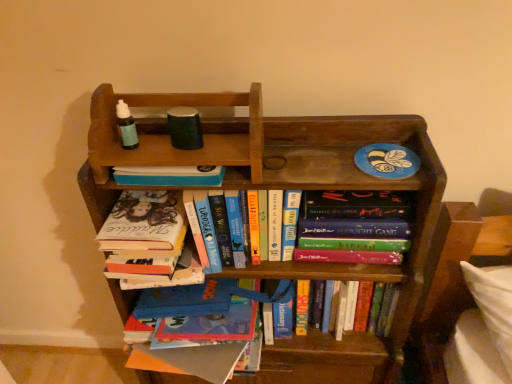
The image size is (512, 384). What do you see at coordinates (384, 306) in the screenshot? I see `hardcover book at center, arranged as the first book when ordered from the bottom` at bounding box center [384, 306].

This screenshot has height=384, width=512. Find the location of `wooden bookcase at center`. wooden bookcase at center is located at coordinates (283, 188).

You are a GUI agent. You are given a task and a screenshot of the screen. Output one action in this format:
    pyautogui.click(x=<x>, y=<y>)
    Task: Click on the bookcase below the hardcover book at center, placed as the 2th book when sorted from bottom to top (from a real-world perspective)
    This screenshot has height=384, width=512.
    Given the screenshot: What is the action you would take?
    pyautogui.click(x=283, y=188)

Does wooden bookcase at center lie behind hardcover book at center, placed as the 2th book when sorted from bottom to top?

No, it is not.

From the image's perspective, between wooden bookcase at center and hardcover book at center, placed as the 2th book when sorted from bottom to top, which one is located above?

hardcover book at center, placed as the 2th book when sorted from bottom to top, from the image's perspective.

From a real-world perspective, which is physically below, wooden bookcase at center or hardcover book at center, which is the second book from top to bottom?

From a 3D spatial view, wooden bookcase at center is below.

Is hardcover book at center, positioned as the first book in top-to-bottom order, a part of wooden bookcase at center?

That's correct, hardcover book at center, positioned as the first book in top-to-bottom order, is inside wooden bookcase at center.

Is wooden bookcase at center wider or thinner than hardcover book at center, positioned as the first book in top-to-bottom order?

In the image, wooden bookcase at center appears to be wider than hardcover book at center, positioned as the first book in top-to-bottom order.

Can you confirm if wooden bookcase at center is bigger than hardcover book at center, positioned as the first book in top-to-bottom order?

Correct, wooden bookcase at center is larger in size than hardcover book at center, positioned as the first book in top-to-bottom order.

Based on the photo, how distant is wooden bookcase at center from hardcover book at center, acting as the 3th book starting from the bottom?

7.01 inches.

Is hardcover book at center, placed as the 2th book when sorted from bottom to top, surrounding hardcover book at center, arranged as the first book when ordered from the bottom?

No, hardcover book at center, placed as the 2th book when sorted from bottom to top, does not contain hardcover book at center, arranged as the first book when ordered from the bottom.

Considering the sizes of hardcover book at center, placed as the 2th book when sorted from bottom to top, and hardcover book at center, arranged as the first book when ordered from the bottom, in the image, is hardcover book at center, placed as the 2th book when sorted from bottom to top, wider or thinner than hardcover book at center, arranged as the first book when ordered from the bottom,?

hardcover book at center, placed as the 2th book when sorted from bottom to top, is thinner than hardcover book at center, arranged as the first book when ordered from the bottom.

Does hardcover book at center, placed as the 2th book when sorted from bottom to top, come in front of hardcover book at center, which appears as the 3th book when viewed from the top?

Yes, it is.

Could you tell me if hardcover book at center, placed as the 2th book when sorted from bottom to top, is turned towards hardcover book at center, which appears as the 3th book when viewed from the top?

No, hardcover book at center, placed as the 2th book when sorted from bottom to top, is not facing towards hardcover book at center, which appears as the 3th book when viewed from the top.

Are hardcover book at center, placed as the 2th book when sorted from bottom to top, and hardcover book at center, positioned as the first book in top-to-bottom order, far apart?

No, hardcover book at center, placed as the 2th book when sorted from bottom to top, is not far away from hardcover book at center, positioned as the first book in top-to-bottom order.

Is hardcover book at center, placed as the 2th book when sorted from bottom to top, oriented towards hardcover book at center, acting as the 3th book starting from the bottom?

No, hardcover book at center, placed as the 2th book when sorted from bottom to top, is not aimed at hardcover book at center, acting as the 3th book starting from the bottom.

Identify the location of the 2nd book to the right of the hardcover book at center, positioned as the first book in top-to-bottom order, starting your count from the anchor. 356,225.

Based on the photo, is hardcover book at center, arranged as the first book when ordered from the bottom, at the back of wooden bookcase at center?

Yes, wooden bookcase at center is facing away from hardcover book at center, arranged as the first book when ordered from the bottom.

Is wooden bookcase at center closer to the viewer compared to hardcover book at center, which appears as the 3th book when viewed from the top?

Yes, the depth of wooden bookcase at center is less than that of hardcover book at center, which appears as the 3th book when viewed from the top.

Considering the relative sizes of wooden bookcase at center and hardcover book at center, which appears as the 3th book when viewed from the top, in the image provided, is wooden bookcase at center smaller than hardcover book at center, which appears as the 3th book when viewed from the top,?

Incorrect, wooden bookcase at center is not smaller in size than hardcover book at center, which appears as the 3th book when viewed from the top.

Are wooden bookcase at center and hardcover book at center, which appears as the 3th book when viewed from the top, beside each other?

wooden bookcase at center and hardcover book at center, which appears as the 3th book when viewed from the top, are not in contact.

Is hardcover book at center, positioned as the first book in top-to-bottom order, oriented towards hardcover book at center, which appears as the 3th book when viewed from the top?

No, hardcover book at center, positioned as the first book in top-to-bottom order, is not aimed at hardcover book at center, which appears as the 3th book when viewed from the top.

Is hardcover book at center, acting as the 3th book starting from the bottom, completely or partially outside of hardcover book at center, arranged as the first book when ordered from the bottom?

That's correct, hardcover book at center, acting as the 3th book starting from the bottom, is outside of hardcover book at center, arranged as the first book when ordered from the bottom.

Does hardcover book at center, acting as the 3th book starting from the bottom, appear on the left side of hardcover book at center, arranged as the first book when ordered from the bottom?

Correct, you'll find hardcover book at center, acting as the 3th book starting from the bottom, to the left of hardcover book at center, arranged as the first book when ordered from the bottom.

Who is bigger, hardcover book at center, positioned as the first book in top-to-bottom order, or hardcover book at center, arranged as the first book when ordered from the bottom?

With larger size is hardcover book at center, arranged as the first book when ordered from the bottom.

Is hardcover book at center, placed as the 2th book when sorted from bottom to top, at the back of hardcover book at center, positioned as the first book in top-to-bottom order?

No, hardcover book at center, positioned as the first book in top-to-bottom order,'s orientation is not away from hardcover book at center, placed as the 2th book when sorted from bottom to top.

From the image's perspective, who appears lower, hardcover book at center, acting as the 3th book starting from the bottom, or hardcover book at center, placed as the 2th book when sorted from bottom to top?

hardcover book at center, placed as the 2th book when sorted from bottom to top.

Is hardcover book at center, positioned as the first book in top-to-bottom order, touching hardcover book at center, placed as the 2th book when sorted from bottom to top?

No, hardcover book at center, positioned as the first book in top-to-bottom order, is not beside hardcover book at center, placed as the 2th book when sorted from bottom to top.

How many degrees apart are the facing directions of hardcover book at center, acting as the 3th book starting from the bottom, and hardcover book at center, which is the second book from top to bottom?

2.19 degrees.

I want to click on bookcase directly beneath the hardcover book at center, placed as the 2th book when sorted from bottom to top (from a real-world perspective), so click(x=283, y=188).

Where is `book that is the 3rd object above the wooden bookcase at center (from a real-world perspective)`? book that is the 3rd object above the wooden bookcase at center (from a real-world perspective) is located at coordinates (215, 228).

Estimate the real-world distances between objects in this image. Which object is closer to hardcover book at center, acting as the 3th book starting from the bottom, wooden bookcase at center or hardcover book at center, which is the second book from top to bottom?

The object closer to hardcover book at center, acting as the 3th book starting from the bottom, is wooden bookcase at center.

Which object lies nearer to the anchor point wooden bookcase at center, hardcover book at center, which is the second book from top to bottom, or hardcover book at center, which appears as the 3th book when viewed from the top?

hardcover book at center, which is the second book from top to bottom.

Estimate the real-world distances between objects in this image. Which object is further from hardcover book at center, acting as the 3th book starting from the bottom, hardcover book at center, which is the second book from top to bottom, or wooden bookcase at center?

hardcover book at center, which is the second book from top to bottom, lies further to hardcover book at center, acting as the 3th book starting from the bottom, than the other object.

Estimate the real-world distances between objects in this image. Which object is closer to hardcover book at center, arranged as the first book when ordered from the bottom, hardcover book at center, acting as the 3th book starting from the bottom, or hardcover book at center, which is the second book from top to bottom?

hardcover book at center, which is the second book from top to bottom, lies closer to hardcover book at center, arranged as the first book when ordered from the bottom, than the other object.

Considering their positions, is hardcover book at center, which appears as the 3th book when viewed from the top, positioned further to hardcover book at center, which is the second book from top to bottom, than wooden bookcase at center?

Among the two, hardcover book at center, which appears as the 3th book when viewed from the top, is located further to hardcover book at center, which is the second book from top to bottom.

Which object lies further to the anchor point wooden bookcase at center, hardcover book at center, arranged as the first book when ordered from the bottom, or hardcover book at center, which is the second book from top to bottom?

hardcover book at center, arranged as the first book when ordered from the bottom, is further to wooden bookcase at center.

Considering their positions, is hardcover book at center, which appears as the 3th book when viewed from the top, positioned closer to hardcover book at center, positioned as the first book in top-to-bottom order, than hardcover book at center, which is the second book from top to bottom?

The object closer to hardcover book at center, positioned as the first book in top-to-bottom order, is hardcover book at center, which is the second book from top to bottom.

Considering their positions, is hardcover book at center, placed as the 2th book when sorted from bottom to top, positioned closer to hardcover book at center, positioned as the first book in top-to-bottom order, than hardcover book at center, arranged as the first book when ordered from the bottom?

hardcover book at center, placed as the 2th book when sorted from bottom to top, lies closer to hardcover book at center, positioned as the first book in top-to-bottom order, than the other object.

You are a GUI agent. You are given a task and a screenshot of the screen. Output one action in this format:
    pyautogui.click(x=<x>, y=<y>)
    Task: Click on the bookcase located between hardcover book at center, positioned as the first book in top-to-bottom order, and hardcover book at center, which is the second book from top to bottom, in the left-right direction
    This screenshot has width=512, height=384.
    Given the screenshot: What is the action you would take?
    pyautogui.click(x=283, y=188)

Identify the location of book between hardcover book at center, positioned as the first book in top-to-bottom order, and hardcover book at center, arranged as the first book when ordered from the bottom, vertically. (356, 225).